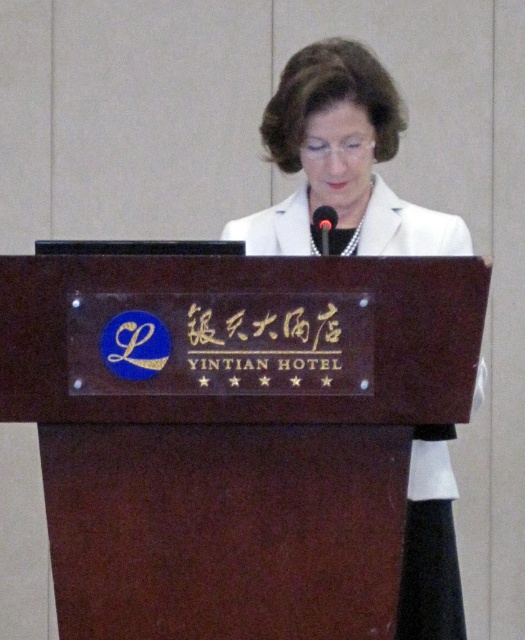
Does white glossy coat at center appear on the right side of black glossy text at center?

Correct, you'll find white glossy coat at center to the right of black glossy text at center.

Which is more to the left, white glossy coat at center or black glossy text at center?

black glossy text at center is more to the left.

Is point (301, 232) less distant than point (270, 305)?

No, it is behind (270, 305).

Find the location of a particular element. This screenshot has width=525, height=640. white glossy coat at center is located at coordinates (341, 163).

Can you confirm if brown polished wood podium at center is wider than black glossy text at center?

Indeed, brown polished wood podium at center has a greater width compared to black glossy text at center.

Which is above, brown polished wood podium at center or black glossy text at center?

black glossy text at center

Locate an element on the screen. brown polished wood podium at center is located at coordinates (236, 456).

Between point (361, 524) and point (312, 232), which one is positioned in front?

Point (361, 524) is more forward.

Does brown polished wood podium at center appear under black plastic microphone at center?

Yes.

Is point (296, 449) closer to viewer compared to point (329, 227)?

Yes, point (296, 449) is closer to viewer.

In order to click on brown polished wood podium at center in this screenshot , I will do `click(236, 456)`.